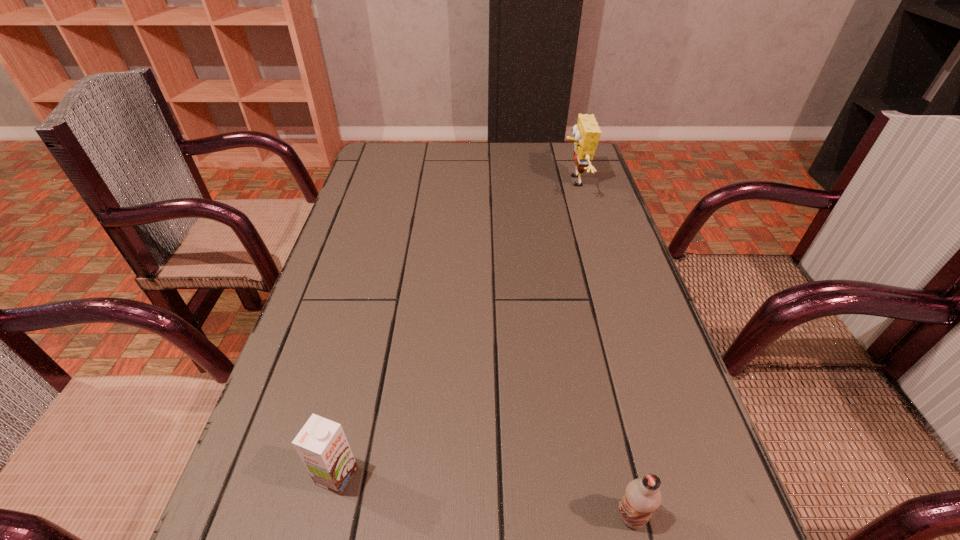
Identify which object is located as the second nearest to the second nearest object. Please provide its 2D coordinates. Your answer should be formatted as a tuple, i.e. [(x, y)], where the tuple contains the x and y coordinates of a point satisfying the conditions above.

[(586, 132)]

This screenshot has width=960, height=540. I want to click on the closest object to the farthest object, so click(x=642, y=497).